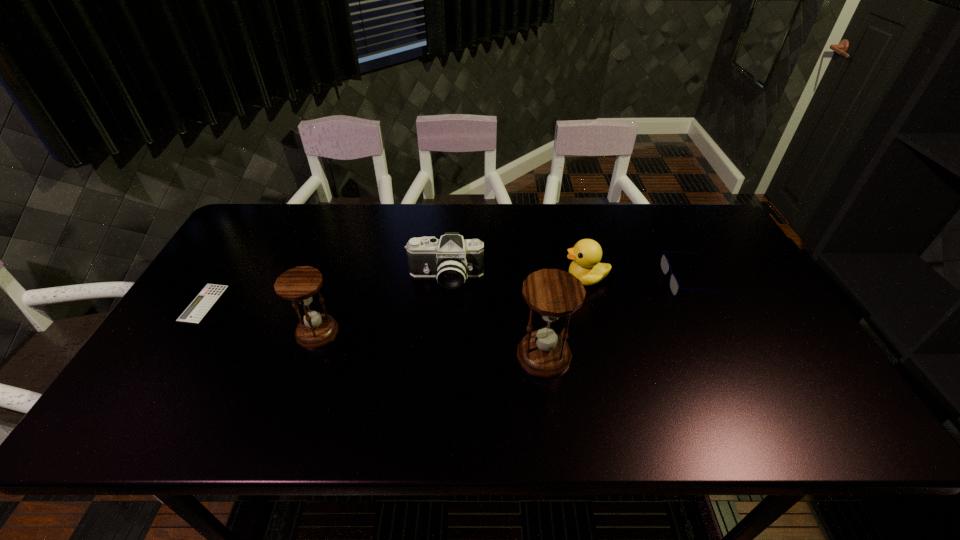
With all hourglasss evenly spaced, where should an extra hourglass be placed on the right to continue the pattern? Please point out a vacant space. Please provide its 2D coordinates. Your answer should be formatted as a tuple, i.e. [(x, y)], where the tuple contains the x and y coordinates of a point satisfying the conditions above.

[(794, 381)]